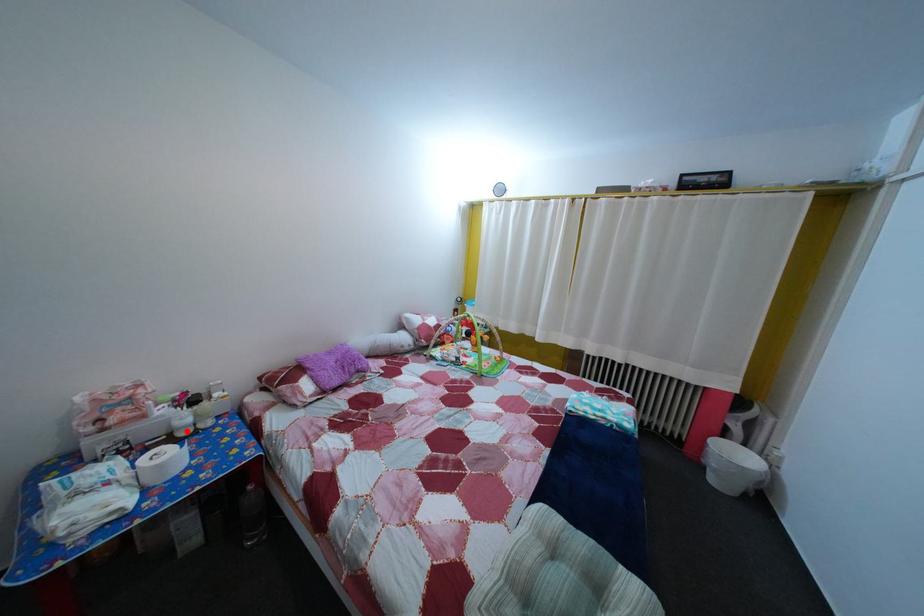
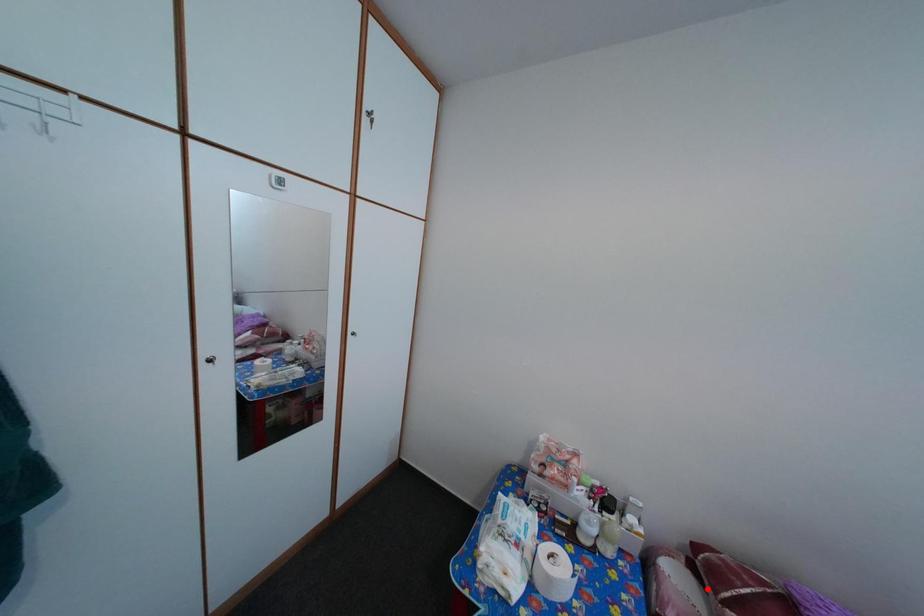
I am providing you with two images of the same scene from different viewpoints. A red point is marked on the first image and another point is marked on the second image. Is the marked point in image1 the same physical position as the marked point in image2?

No